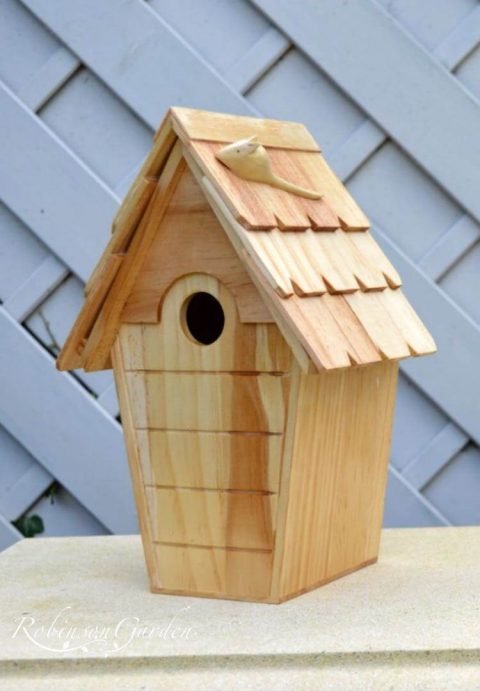
I want to click on doorway, so click(206, 319).